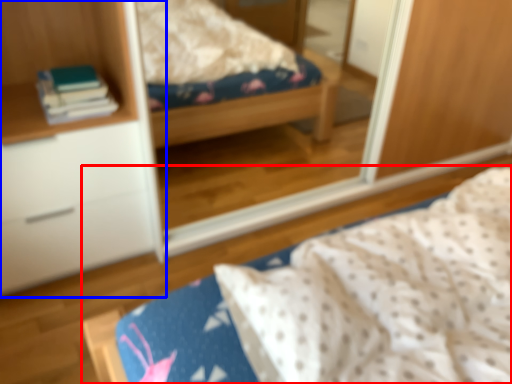
Question: Which object is further to the camera taking this photo, bed (highlighted by a red box) or cabinetry (highlighted by a blue box)?

Choices:
 (A) bed
 (B) cabinetry

Answer: (B)